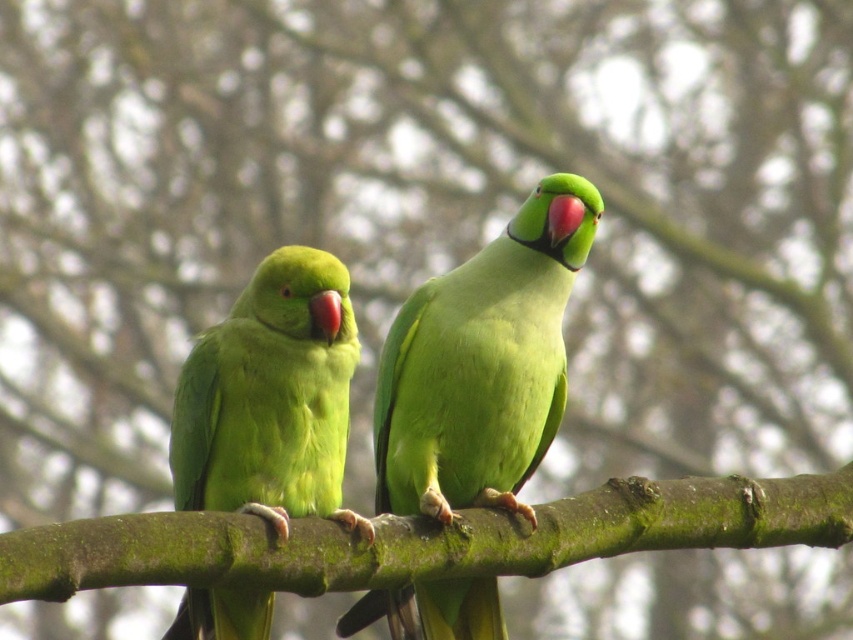
You are a birdwatcher trying to capture both parrots in a single photo. Given that your camera has a maximum focus range of 20 inches, will you be able to include both the green matte parrot at center and the green matte parrot at left in the same frame without moving the camera?

The distance between the green matte parrot at center and the green matte parrot at left is 18.35 inches, which is within the camera maximum focus range of 20 inches. Therefore, you can include both parrots in the same frame without moving the camera.

You are a photographer standing 10 feet away from a green mossy branch at center. You want to take a clear photo of it. Will you need to move closer or farther away to ensure the branch fills the frame properly?

The green mossy branch at center is 9.06 feet away from the camera. Since you are currently 10 feet away, you need to move closer by approximately 0.94 feet to reach the optimal distance for the photo.